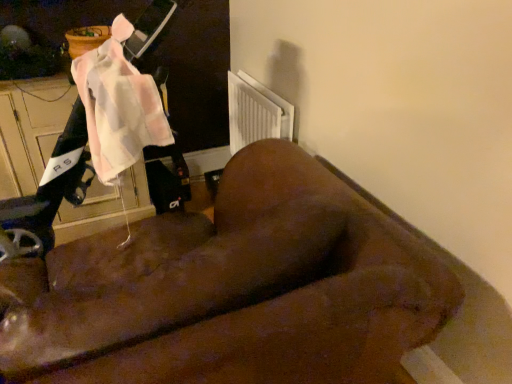
Where is `brown fuzzy couch at center`? The height and width of the screenshot is (384, 512). brown fuzzy couch at center is located at coordinates click(x=233, y=290).

The width and height of the screenshot is (512, 384). Describe the element at coordinates (233, 290) in the screenshot. I see `brown fuzzy couch at center` at that location.

You are a GUI agent. You are given a task and a screenshot of the screen. Output one action in this format:
    pyautogui.click(x=<x>, y=<y>)
    Task: Click on the pink fabric mobility scooter at upper left
    
    Given the screenshot: What is the action you would take?
    pyautogui.click(x=95, y=132)

Image resolution: width=512 pixels, height=384 pixels. What do you see at coordinates (95, 132) in the screenshot? I see `pink fabric mobility scooter at upper left` at bounding box center [95, 132].

Find the location of `brown fuzzy couch at center`. brown fuzzy couch at center is located at coordinates (233, 290).

Is brown fuzzy couch at center to the right of pink fabric mobility scooter at upper left from the viewer's perspective?

Indeed, brown fuzzy couch at center is positioned on the right side of pink fabric mobility scooter at upper left.

Does brown fuzzy couch at center lie behind pink fabric mobility scooter at upper left?

No, the depth of brown fuzzy couch at center is less than that of pink fabric mobility scooter at upper left.

Between point (390, 364) and point (127, 42), which one is positioned in front?

Positioned in front is point (390, 364).

From the image's perspective, relative to pink fabric mobility scooter at upper left, is brown fuzzy couch at center above or below?

Clearly, from the image's perspective, brown fuzzy couch at center is below pink fabric mobility scooter at upper left.

From a real-world perspective, is brown fuzzy couch at center positioned under pink fabric mobility scooter at upper left based on gravity?

Correct, in the physical world, brown fuzzy couch at center is lower than pink fabric mobility scooter at upper left.

Is brown fuzzy couch at center thinner than pink fabric mobility scooter at upper left?

In fact, brown fuzzy couch at center might be wider than pink fabric mobility scooter at upper left.

In the scene shown: Which of these two, brown fuzzy couch at center or pink fabric mobility scooter at upper left, stands shorter?

Standing shorter between the two is pink fabric mobility scooter at upper left.

Which of these two, brown fuzzy couch at center or pink fabric mobility scooter at upper left, is smaller?

pink fabric mobility scooter at upper left is smaller.

Would you say pink fabric mobility scooter at upper left is part of brown fuzzy couch at center's contents?

That's incorrect, pink fabric mobility scooter at upper left is not inside brown fuzzy couch at center.

Is brown fuzzy couch at center touching pink fabric mobility scooter at upper left?

No, brown fuzzy couch at center is not making contact with pink fabric mobility scooter at upper left.

Is brown fuzzy couch at center positioned with its back to pink fabric mobility scooter at upper left?

brown fuzzy couch at center does not have its back to pink fabric mobility scooter at upper left.

Identify the location of furniture on the right of pink fabric mobility scooter at upper left. (233, 290).

Visually, is pink fabric mobility scooter at upper left positioned to the left or to the right of brown fuzzy couch at center?

pink fabric mobility scooter at upper left is positioned on brown fuzzy couch at center's left side.

Which is behind, pink fabric mobility scooter at upper left or brown fuzzy couch at center?

pink fabric mobility scooter at upper left is further away from the camera.

Which is in front, point (71, 181) or point (252, 234)?

The point (252, 234) is closer to the camera.

From the image's perspective, is pink fabric mobility scooter at upper left positioned above or below brown fuzzy couch at center?

Clearly, from the image's perspective, pink fabric mobility scooter at upper left is above brown fuzzy couch at center.

From a real-world perspective, who is located higher, pink fabric mobility scooter at upper left or brown fuzzy couch at center?

pink fabric mobility scooter at upper left, from a real-world perspective.

Considering the relative sizes of pink fabric mobility scooter at upper left and brown fuzzy couch at center in the image provided, is pink fabric mobility scooter at upper left thinner than brown fuzzy couch at center?

Indeed, pink fabric mobility scooter at upper left has a lesser width compared to brown fuzzy couch at center.

Is pink fabric mobility scooter at upper left taller than brown fuzzy couch at center?

No, pink fabric mobility scooter at upper left is not taller than brown fuzzy couch at center.

Who is bigger, pink fabric mobility scooter at upper left or brown fuzzy couch at center?

Bigger between the two is brown fuzzy couch at center.

Which is correct: pink fabric mobility scooter at upper left is inside brown fuzzy couch at center, or outside of it?

pink fabric mobility scooter at upper left is not inside brown fuzzy couch at center, it's outside.

Is there a large distance between pink fabric mobility scooter at upper left and brown fuzzy couch at center?

That's not correct — pink fabric mobility scooter at upper left is a little close to brown fuzzy couch at center.

Is pink fabric mobility scooter at upper left positioned with its back to brown fuzzy couch at center?

No, pink fabric mobility scooter at upper left is not facing away from brown fuzzy couch at center.

How many degrees apart are the facing directions of pink fabric mobility scooter at upper left and brown fuzzy couch at center?

pink fabric mobility scooter at upper left and brown fuzzy couch at center are facing 91.6 degrees away from each other.

Measure the distance between pink fabric mobility scooter at upper left and brown fuzzy couch at center.

They are 57.02 centimeters apart.

I want to click on furniture on the right side of pink fabric mobility scooter at upper left, so click(x=233, y=290).

The image size is (512, 384). I want to click on mobility scooter located behind the brown fuzzy couch at center, so click(x=95, y=132).

Find the location of a particular element. The image size is (512, 384). furniture beneath the pink fabric mobility scooter at upper left (from a real-world perspective) is located at coordinates (233, 290).